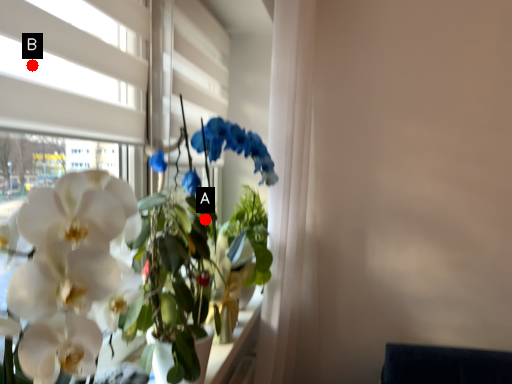
Question: Two points are circled on the image, labeled by A and B beside each circle. Which point is further to the camera?

Choices:
 (A) A is further
 (B) B is further

Answer: (A)